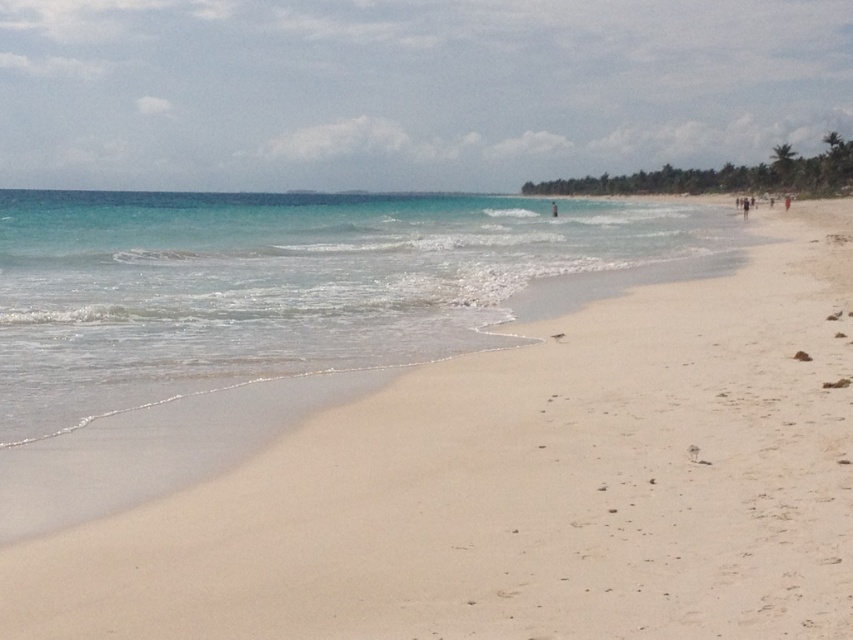
Which is below, clear blue water at center or light blue fabric person at center?

Positioned lower is clear blue water at center.

Which of these two, clear blue water at center or light blue fabric person at center, stands shorter?

light blue fabric person at center is shorter.

Is point (32, 236) positioned in front of point (553, 216)?

Yes, it is.

Locate an element on the screen. Image resolution: width=853 pixels, height=640 pixels. clear blue water at center is located at coordinates (277, 285).

Between white sand at center and clear blue water at center, which one appears on the left side from the viewer's perspective?

clear blue water at center

Between white sand at center and clear blue water at center, which one is positioned higher?

clear blue water at center is above.

Where is `white sand at center`? The image size is (853, 640). white sand at center is located at coordinates (524, 486).

Is white sand at center positioned in front of light blue fabric person at center?

Yes, white sand at center is closer to the viewer.

Between point (572, 436) and point (552, 208), which one is positioned behind?

The point (552, 208) is behind.

Where is `white sand at center`? white sand at center is located at coordinates (524, 486).